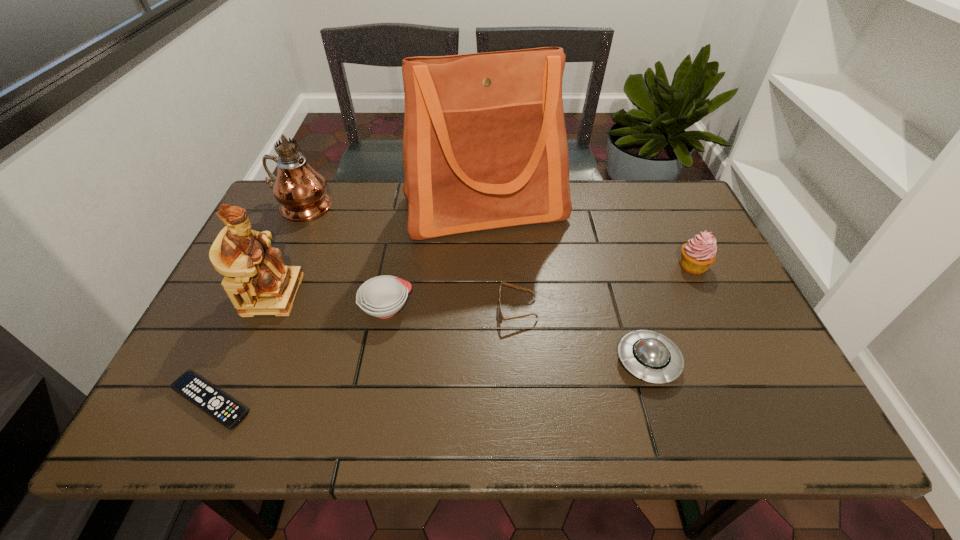
Identify the location of shopping bag. (484, 143).

Locate an element on the screen. This screenshot has height=540, width=960. oil lamp is located at coordinates (301, 191).

The height and width of the screenshot is (540, 960). In order to click on the sixth shortest object in this screenshot , I will do `click(257, 282)`.

The image size is (960, 540). Identify the location of cupcake. (699, 253).

Find the location of a particular element. This screenshot has width=960, height=540. the rightmost object is located at coordinates (699, 253).

Find the location of `the second object from right to left`. the second object from right to left is located at coordinates (646, 354).

Find the location of a particular element. soup bowl is located at coordinates (383, 296).

Where is `the seventh tallest object`? This screenshot has height=540, width=960. the seventh tallest object is located at coordinates (500, 315).

Identify the location of the shortest object. Image resolution: width=960 pixels, height=540 pixels. (228, 412).

The height and width of the screenshot is (540, 960). In order to click on vacant region located 0.150m on the front of the shopping bag in this screenshot , I will do (x=486, y=282).